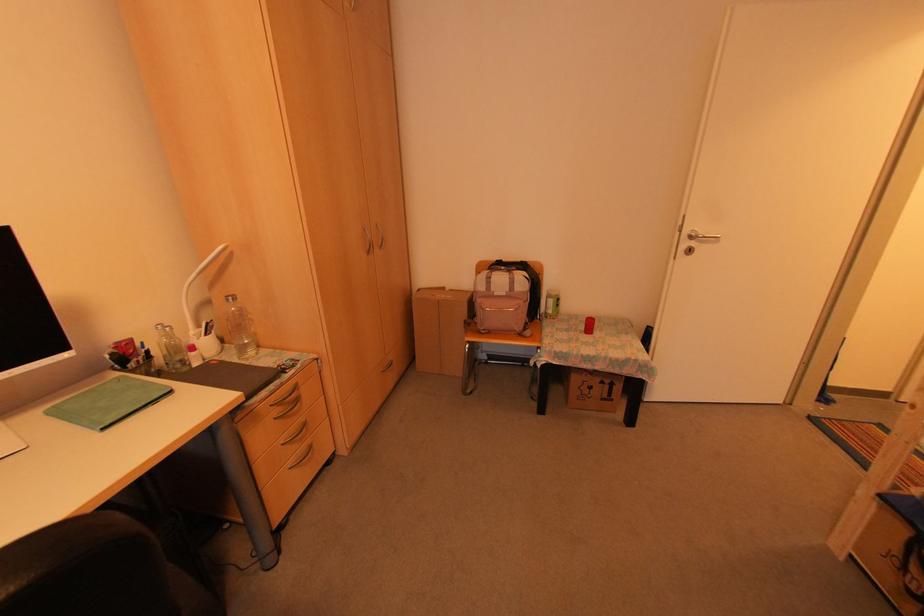
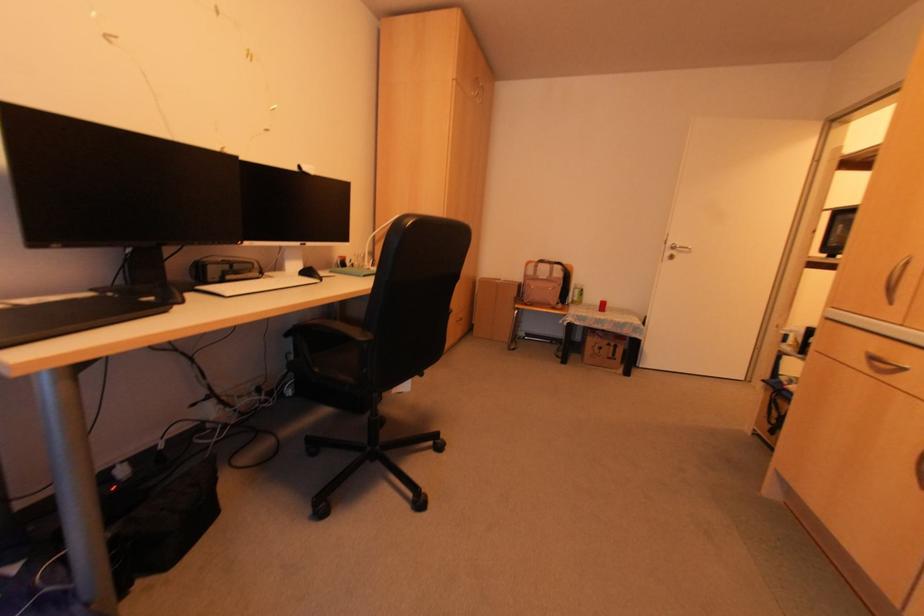
Locate, in the second image, the point that corresponds to pixel 588 326 in the first image.

(601, 307)